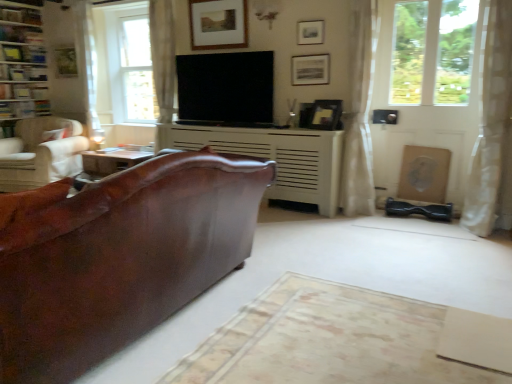
Question: Considering the positions of matte black picture frame at upper center, the 4th picture frame viewed from the back, and flat screen tv at center in the image, is matte black picture frame at upper center, the 4th picture frame viewed from the back, bigger or smaller than flat screen tv at center?

Choices:
 (A) big
 (B) small

Answer: (B)

Question: Is matte black picture frame at upper center, the first picture frame from the front, spatially inside flat screen tv at center, or outside of it?

Choices:
 (A) inside
 (B) outside

Answer: (B)

Question: Considering the real-world distances, which object is farthest from the beige carpet at center?

Choices:
 (A) white textured fireplace at center
 (B) matte black picture frame at upper center, the first picture frame from the front
 (C) flat screen tv at center
 (D) matte gold picture frame at upper left, which is the 1th picture frame in left-to-right order
 (E) white wooden tv cabinet at upper center

Answer: (D)

Question: Considering the real-world distances, which object is farthest from the white textured fireplace at center?

Choices:
 (A) matte black picture frame at upper center, the 4th picture frame in the left-to-right sequence
 (B) flat screen tv at center
 (C) matte black picture frame at upper center, the 4th picture frame viewed from the back
 (D) white textured curtain at right, placed as the second curtain when sorted from left to right
 (E) brown leather table at left

Answer: (D)